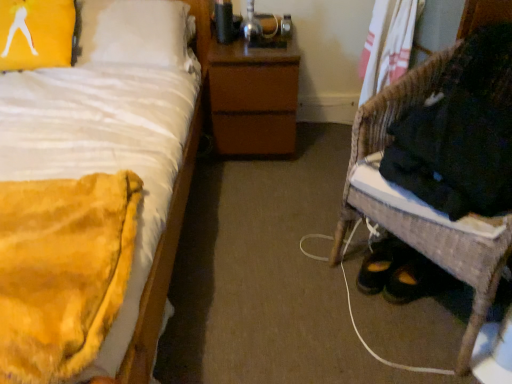
Question: Considering the positions of woven wicker chair at lower right and yellow fabric pillow at upper left in the image, is woven wicker chair at lower right wider or thinner than yellow fabric pillow at upper left?

Choices:
 (A) thin
 (B) wide

Answer: (B)

Question: Considering their positions, is woven wicker chair at lower right located in front of or behind yellow fabric pillow at upper left?

Choices:
 (A) behind
 (B) front

Answer: (B)

Question: Which object is the farthest from the brown matte nightstand at center?

Choices:
 (A) yellow plush blanket at left
 (B) woven wicker chair at lower right
 (C) yellow fabric pillow at upper left

Answer: (B)

Question: Which object is positioned closest to the woven wicker chair at lower right?

Choices:
 (A) yellow plush blanket at left
 (B) brown matte nightstand at center
 (C) yellow fabric pillow at upper left

Answer: (B)